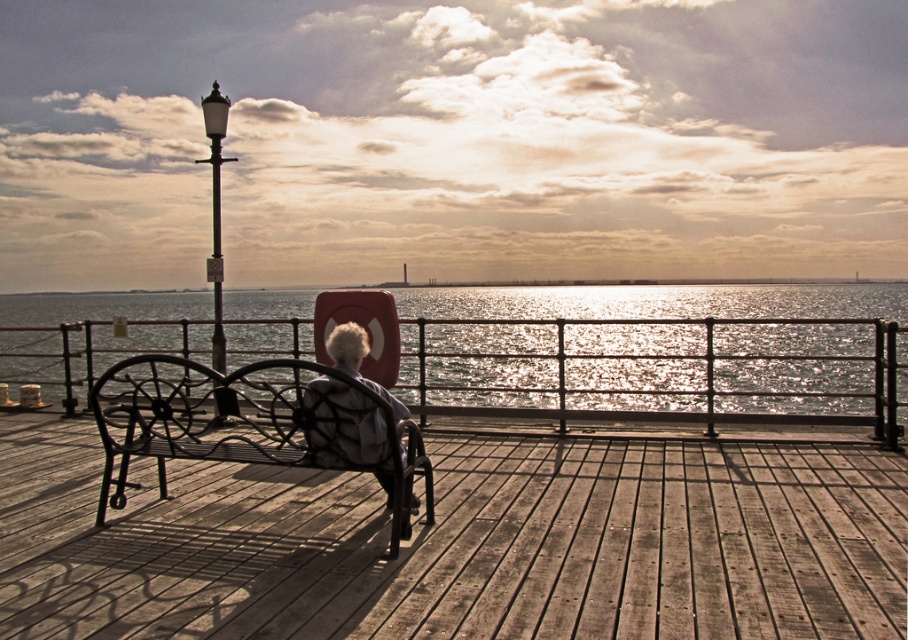
What is located at the coordinates point (459, 541) in the image?

The wooden deck is located at point (459, 541) in the image.

You are a photographer trying to capture a portrait of the person sitting on the black wrought iron bench at center. The person has white textured hair at center. To ensure the subject is properly framed, you need to know which object is taller. Which one is taller?

The black wrought iron bench at center is taller than the white textured hair at center.